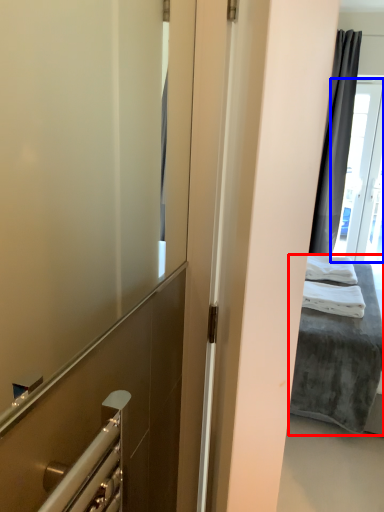
Question: Which of the following is the farthest to the observer, bed (highlighted by a red box) or glass door (highlighted by a blue box)?

Choices:
 (A) bed
 (B) glass door

Answer: (B)